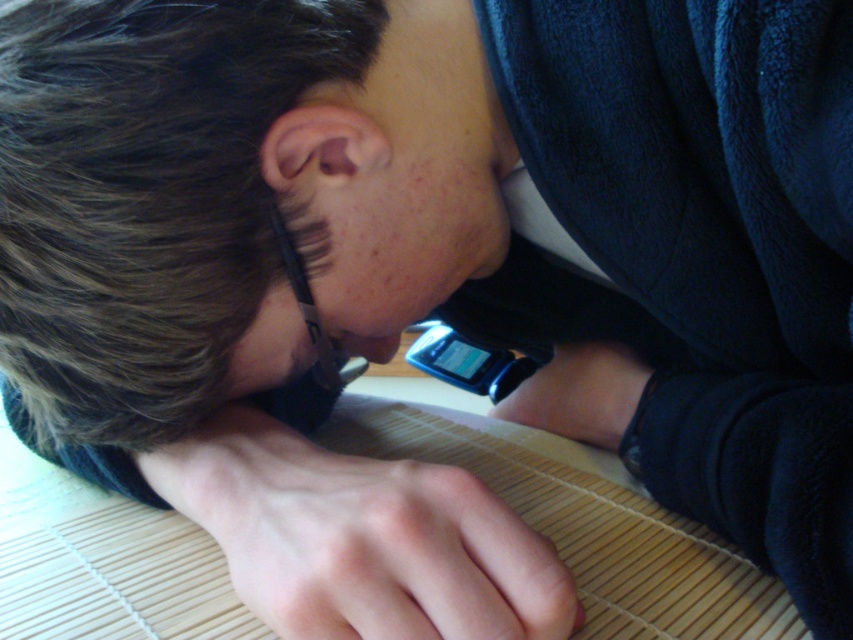
You are a delivery robot trying to place a small package on the dark blue fleece sweatshirt at upper right. The package is 0.1 meters in length. The coordinates of the sweatshirt are given as point (701, 252). What is the minimum distance you need to move from your current position at point 0.5, 0.5 to reach the sweatshirt?

The minimum distance to move from point 0.5, 0.5 to point (701, 252) is calculated using the Euclidean distance formula. The horizontal distance is 0.5 minus 0.394 equals 0.106, and the vertical distance is 0.823 minus 0.5 equals 0.323. Squaring these values gives 0.0112 and 0.1043, respectively. Adding them together equals 0.1155, and taking the square root gives approximately 0.34 meters. Since the package is 0.1 meters long, the robot needs to move at least 0.34 meters to reach the sweatshirt.

You are a photographer trying to capture a close detail shot of the smooth skin hand at lower center and the satin black watch at lower center. Since the watch is smaller, will you need to adjust your camera focus to ensure both are in focus?

The smooth skin hand at lower center is wider than the satin black watch at lower center, so you might need to adjust the focus to ensure both are sharp, as the hand takes up more space in the frame.